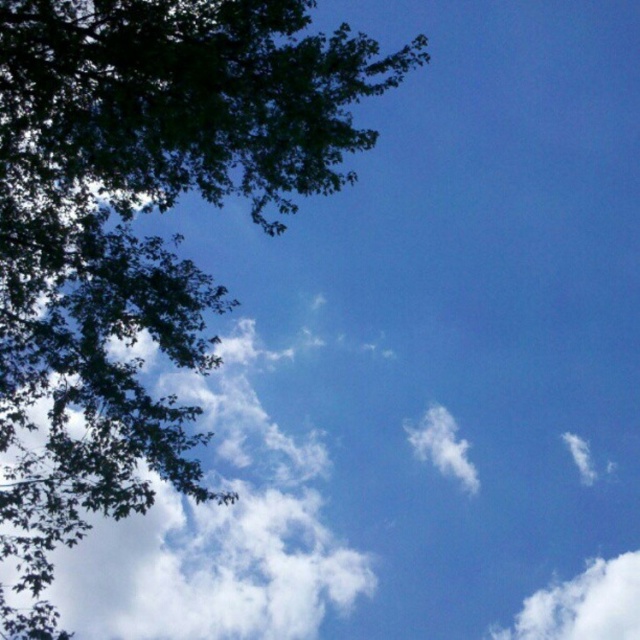
Question: Is white fluffy cloud at lower right smaller than white fluffy cloud at center?

Choices:
 (A) yes
 (B) no

Answer: (B)

Question: Among these points, which one is farthest from the camera?

Choices:
 (A) (317, 550)
 (B) (429, 440)
 (C) (340, 48)

Answer: (B)

Question: Can you confirm if white fluffy cloud at lower right is positioned below white fluffy cloud at center?

Choices:
 (A) no
 (B) yes

Answer: (B)

Question: Among these points, which one is farthest from the camera?

Choices:
 (A) (609, 563)
 (B) (420, 440)
 (C) (337, 120)

Answer: (A)

Question: Which of the following is the farthest from the observer?

Choices:
 (A) white fluffy cloud at lower right
 (B) white fluffy cloud at upper left
 (C) white fluffy cloud at center

Answer: (A)

Question: Does white fluffy cloud at upper left have a smaller size compared to white fluffy cloud at lower right?

Choices:
 (A) no
 (B) yes

Answer: (B)